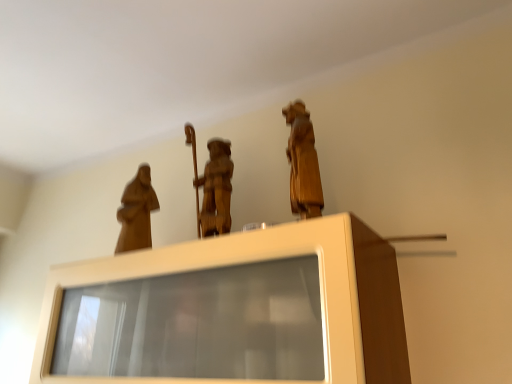
Question: Can you confirm if wooden statue at upper center, the 2th person viewed from the left, is thinner than matte wood statue at left, marked as the second person in a front-to-back arrangement?

Choices:
 (A) no
 (B) yes

Answer: (A)

Question: Can you confirm if wooden statue at upper center, the 2th person viewed from the left, is wider than matte wood statue at left, the 1th person from the back?

Choices:
 (A) no
 (B) yes

Answer: (B)

Question: From the image's perspective, is wooden statue at upper center, which is the 2th person in back-to-front order, on matte wood statue at left, the second person in the right-to-left sequence?

Choices:
 (A) yes
 (B) no

Answer: (A)

Question: Is wooden statue at upper center, positioned as the first person in front-to-back order, to the right of matte wood statue at left, the first person positioned from the left, from the viewer's perspective?

Choices:
 (A) yes
 (B) no

Answer: (A)

Question: Does wooden statue at upper center, the 2th person viewed from the left, have a larger size compared to matte wood statue at left, the first person positioned from the left?

Choices:
 (A) no
 (B) yes

Answer: (B)

Question: Is wooden statue at upper center, which is the 2th person in back-to-front order, facing towards matte wood statue at left, marked as the second person in a front-to-back arrangement?

Choices:
 (A) yes
 (B) no

Answer: (B)

Question: Is matte wood statue at left, the 1th person from the back, taller than wooden statue at upper center, positioned as the first person in front-to-back order?

Choices:
 (A) no
 (B) yes

Answer: (A)

Question: From a real-world perspective, does matte wood statue at left, marked as the second person in a front-to-back arrangement, sit lower than wooden statue at upper center, positioned as the first person in front-to-back order?

Choices:
 (A) yes
 (B) no

Answer: (B)

Question: Considering the relative positions of matte wood statue at left, the first person positioned from the left, and wooden statue at upper center, the 2th person viewed from the left, in the image provided, is matte wood statue at left, the first person positioned from the left, behind wooden statue at upper center, the 2th person viewed from the left,?

Choices:
 (A) yes
 (B) no

Answer: (A)

Question: Can you confirm if matte wood statue at left, the second person in the right-to-left sequence, is shorter than wooden statue at upper center, positioned as the first person in front-to-back order?

Choices:
 (A) yes
 (B) no

Answer: (A)

Question: Can you confirm if matte wood statue at left, the first person positioned from the left, is wider than wooden statue at upper center, positioned as the first person in front-to-back order?

Choices:
 (A) yes
 (B) no

Answer: (B)

Question: Is matte wood statue at left, marked as the second person in a front-to-back arrangement, turned away from wooden statue at upper center, the 2th person viewed from the left?

Choices:
 (A) no
 (B) yes

Answer: (A)

Question: From the image's perspective, is matte wood statue at left, marked as the second person in a front-to-back arrangement, above matte wood cabinet at center?

Choices:
 (A) yes
 (B) no

Answer: (A)